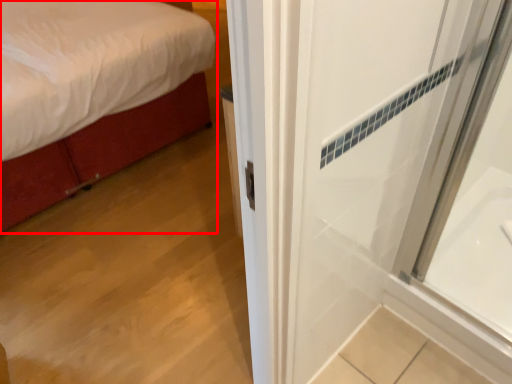
Question: Considering the relative positions of bed (annotated by the red box) and bath in the image provided, where is bed (annotated by the red box) located with respect to the staircase?

Choices:
 (A) left
 (B) right

Answer: (A)